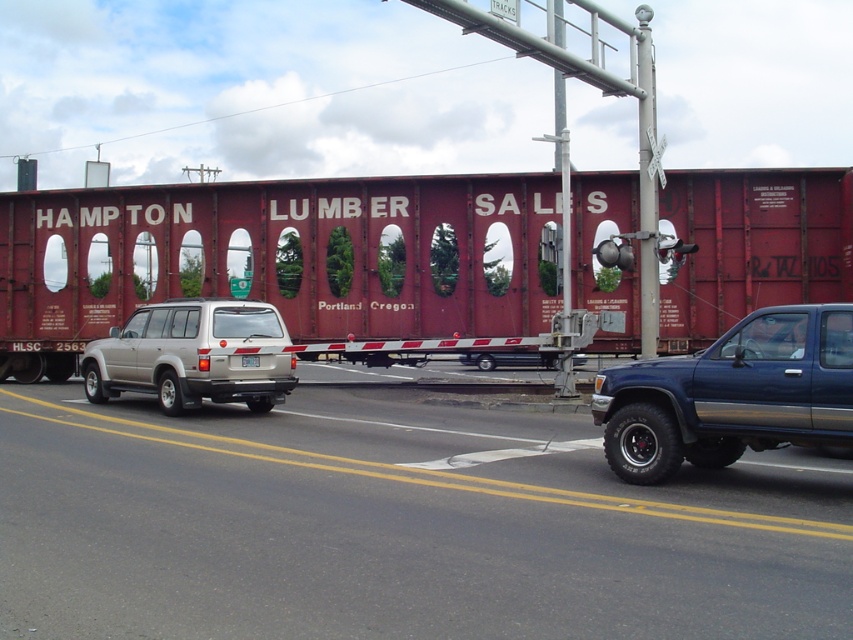
Which is above, gray asphalt road at center or white plastic license plate at center?

white plastic license plate at center is higher up.

Is gray asphalt road at center to the right of white plastic license plate at center from the viewer's perspective?

Correct, you'll find gray asphalt road at center to the right of white plastic license plate at center.

Is point (467, 588) behind point (252, 358)?

That is False.

Identify the location of gray asphalt road at center. The image size is (853, 640). (396, 525).

Is gray asphalt road at center above blue metallic truck at right?

Actually, gray asphalt road at center is below blue metallic truck at right.

Is gray asphalt road at center to the right of blue metallic truck at right from the viewer's perspective?

In fact, gray asphalt road at center is to the left of blue metallic truck at right.

Locate an element on the screen. gray asphalt road at center is located at coordinates (396, 525).

Who is taller, blue metallic truck at right or white plastic license plate at center?

Standing taller between the two is blue metallic truck at right.

Can you confirm if blue metallic truck at right is positioned to the right of white plastic license plate at center?

Indeed, blue metallic truck at right is positioned on the right side of white plastic license plate at center.

The height and width of the screenshot is (640, 853). Find the location of `blue metallic truck at right`. blue metallic truck at right is located at coordinates (730, 394).

The width and height of the screenshot is (853, 640). I want to click on blue metallic truck at right, so click(x=730, y=394).